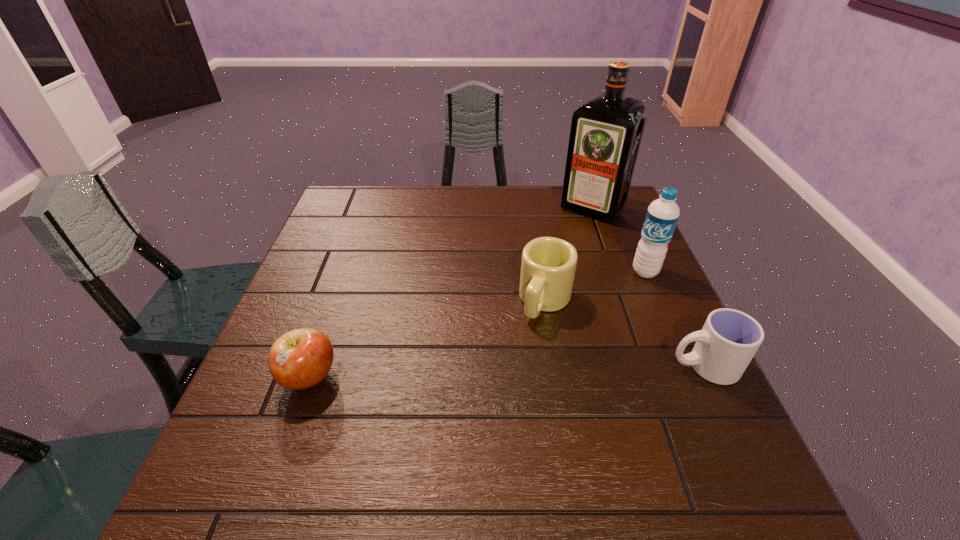
Where is `unoccupied area between the apple and the cup`? This screenshot has height=540, width=960. unoccupied area between the apple and the cup is located at coordinates 506,372.

Where is `unoccupied area between the water bottle and the liquor`? Image resolution: width=960 pixels, height=540 pixels. unoccupied area between the water bottle and the liquor is located at coordinates (619, 240).

This screenshot has height=540, width=960. Find the location of `unoccupied position between the cup and the second object from left to right`. unoccupied position between the cup and the second object from left to right is located at coordinates (625, 333).

Identify the location of blank region between the tallest object and the cup. This screenshot has height=540, width=960. (648, 287).

I want to click on free space that is in between the mug and the cup, so click(625, 333).

At what (x,y) coordinates should I click in order to perform the action: click on free space between the fourth object from right to left and the leftmost object. Please return your answer as a coordinate pair (x, y). The width and height of the screenshot is (960, 540). Looking at the image, I should click on (427, 339).

The image size is (960, 540). I want to click on free spot between the fourth object from right to left and the leftmost object, so click(x=427, y=339).

Locate an element on the screen. The width and height of the screenshot is (960, 540). empty space that is in between the mug and the water bottle is located at coordinates (595, 286).

You are a GUI agent. You are given a task and a screenshot of the screen. Output one action in this format:
    pyautogui.click(x=<x>, y=<y>)
    Task: Click on the vacant area that lies between the tallest object and the water bottle
    The width and height of the screenshot is (960, 540).
    Given the screenshot: What is the action you would take?
    pyautogui.click(x=619, y=240)

Identify which object is the second nearest to the water bottle. Please provide its 2D coordinates. Your answer should be formatted as a tuple, i.e. [(x, y)], where the tuple contains the x and y coordinates of a point satisfying the conditions above.

[(606, 131)]